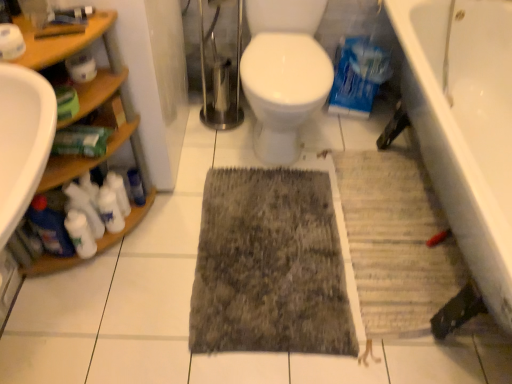
Identify the location of vacant point to the right of white matte cleaning product at left, placed as the 4th cleaning product when sorted from left to right. (167, 230).